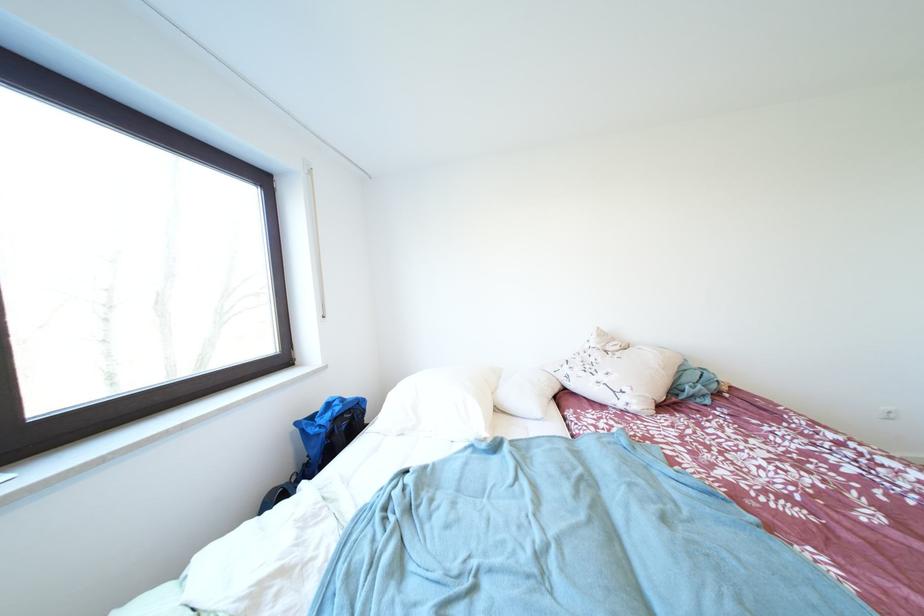
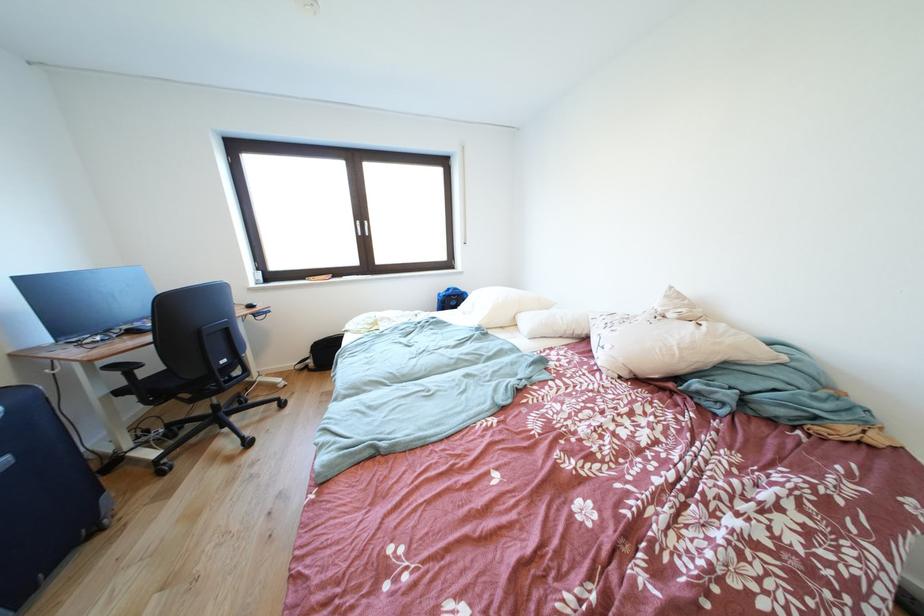
In the second image, find the point that corresponds to (305,428) in the first image.

(447, 299)